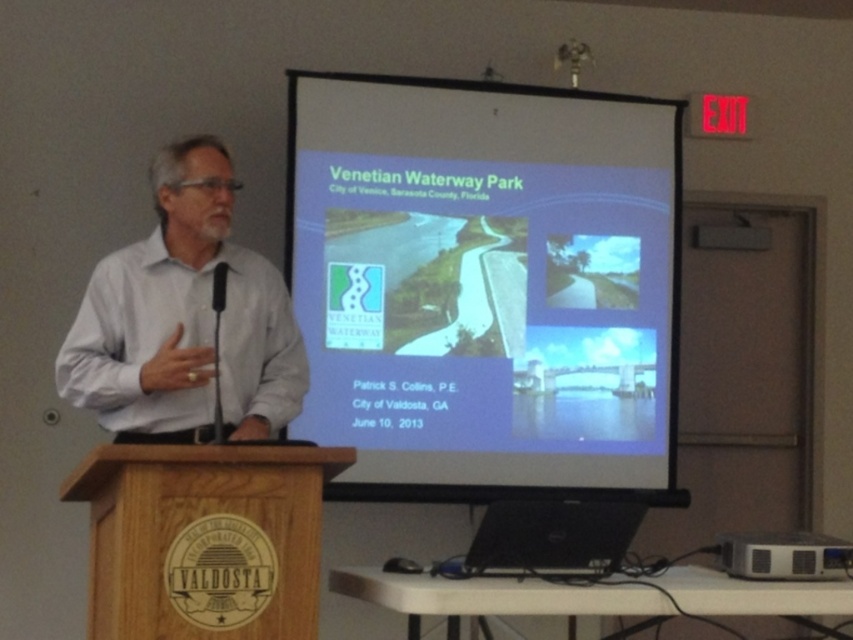
You are attending a presentation and notice the white shirt at left and the black plastic projector at lower right. Which object is taller?

The white shirt at left is taller than the black plastic projector at lower right.

You are setting up for a presentation and need to position a new speaker system. The speaker system requires a clear path between the white matte projection screen at center and the black plastic projector at lower right. Is there an obstruction between them?

The white matte projection screen at center is to the left of the black plastic projector at lower right, so there is no obstruction between them as they are positioned side by side.